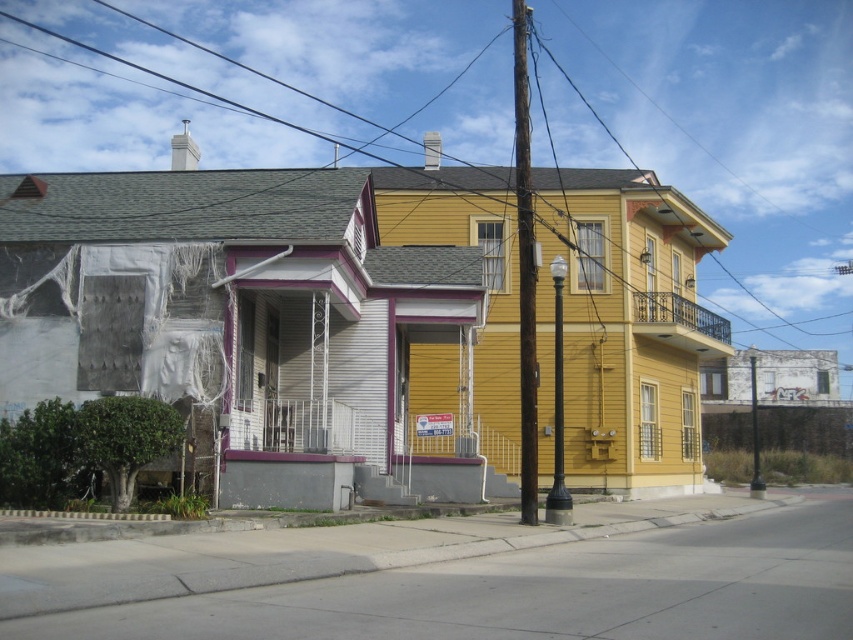
Can you confirm if black wire at upper center is thinner than brown wooden utility pole at center?

No.

The image size is (853, 640). What do you see at coordinates (734, 131) in the screenshot? I see `black wire at upper center` at bounding box center [734, 131].

What do you see at coordinates (734, 131) in the screenshot? The height and width of the screenshot is (640, 853). I see `black wire at upper center` at bounding box center [734, 131].

The width and height of the screenshot is (853, 640). Find the location of `black wire at upper center`. black wire at upper center is located at coordinates (734, 131).